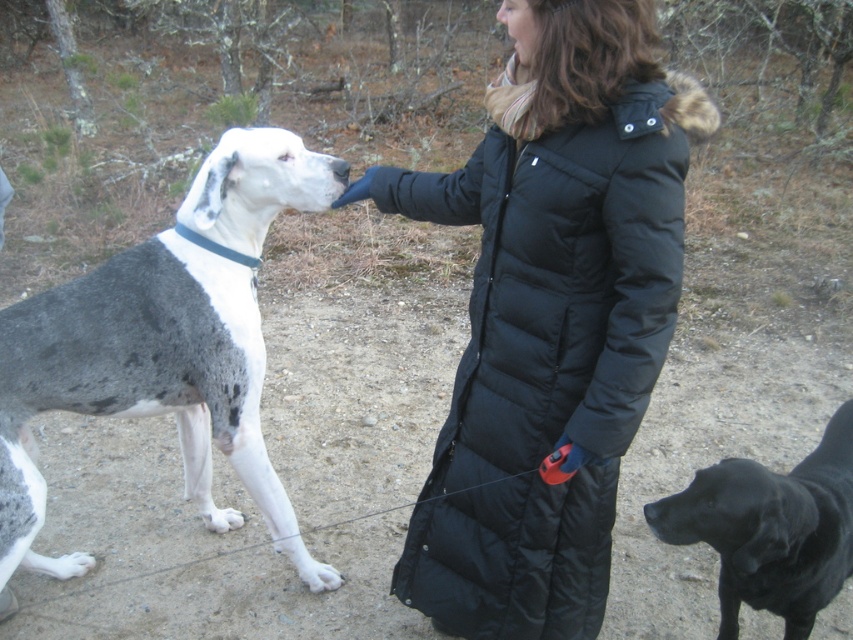
Question: In this image, where is black puffy coat at center located relative to white fur paw at lower left?

Choices:
 (A) below
 (B) above

Answer: (B)

Question: Considering the real-world distances, which object is farthest from the black puffy coat at center?

Choices:
 (A) black glossy dog at lower right
 (B) spotted fur dog at left

Answer: (B)

Question: Which object is farther from the camera taking this photo?

Choices:
 (A) white fur paw at lower left
 (B) black matte nose at upper center

Answer: (A)

Question: Does spotted fur dog at left come behind black glossy dog at lower right?

Choices:
 (A) no
 (B) yes

Answer: (B)

Question: Considering the relative positions of black glossy dog at lower right and white fur paw at lower left in the image provided, where is black glossy dog at lower right located with respect to white fur paw at lower left?

Choices:
 (A) below
 (B) above

Answer: (B)

Question: Which of these objects is positioned farthest from the black glossy dog at lower right?

Choices:
 (A) white fur paw at lower left
 (B) black puffy coat at center

Answer: (A)